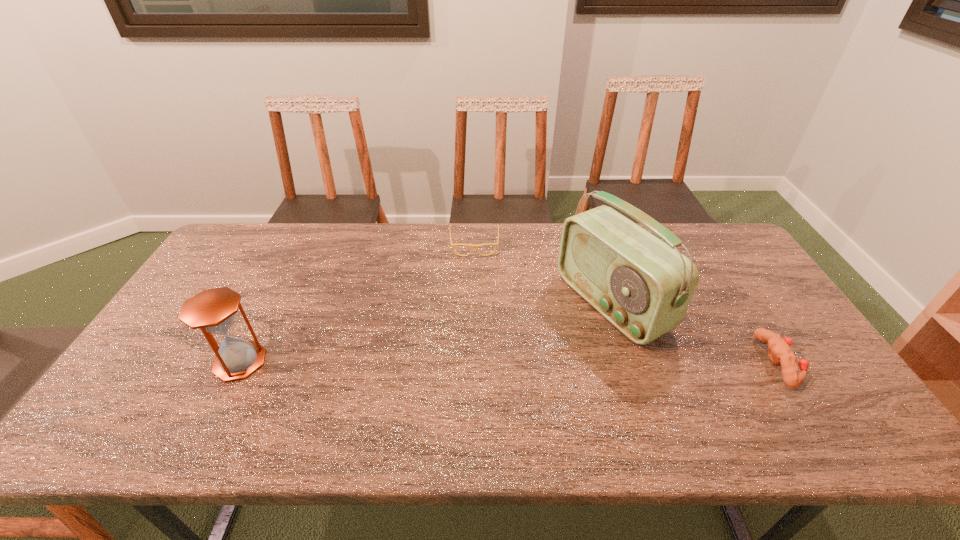
Locate an element on the screen. The image size is (960, 540). vacant region located 0.070m in front of the lenses of the spectacles is located at coordinates (475, 271).

In order to click on vacant space located 0.210m in front of the lenses of the spectacles in this screenshot , I will do click(x=475, y=301).

This screenshot has width=960, height=540. I want to click on free space located 0.360m on the front panel of the tallest object, so click(460, 384).

You are a GUI agent. You are given a task and a screenshot of the screen. Output one action in this format:
    pyautogui.click(x=<x>, y=<y>)
    Task: Click on the vacant space located on the front panel of the tallest object
    This screenshot has width=960, height=540.
    Given the screenshot: What is the action you would take?
    pyautogui.click(x=551, y=339)

This screenshot has width=960, height=540. Identify the location of vacant space situated 0.060m on the front panel of the tallest object. (557, 336).

Locate an element on the screen. The image size is (960, 540). spectacles positioned at the far edge is located at coordinates (496, 244).

Locate an element on the screen. The height and width of the screenshot is (540, 960). radio receiver positioned at the far edge is located at coordinates (643, 286).

This screenshot has width=960, height=540. In order to click on hourglass present at the near edge in this screenshot , I will do `click(213, 310)`.

Where is `puncher that is at the near edge`? The height and width of the screenshot is (540, 960). puncher that is at the near edge is located at coordinates (779, 351).

The image size is (960, 540). I want to click on object at the right edge, so click(x=779, y=351).